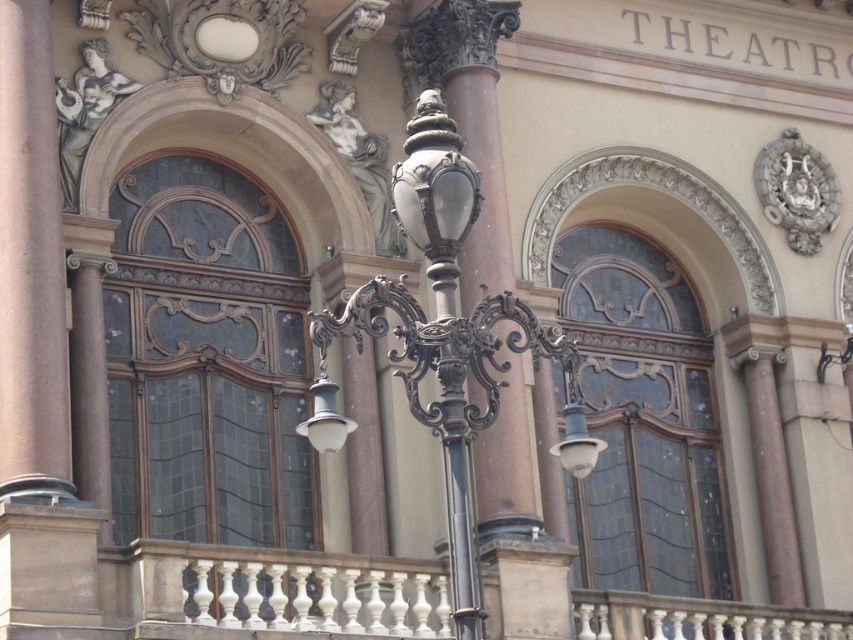
In the scene shown: Measure the distance between polished bronze streetlight at center and smooth pink stone column at left.

A distance of 33.79 feet exists between polished bronze streetlight at center and smooth pink stone column at left.

Image resolution: width=853 pixels, height=640 pixels. Find the location of `polished bronze streetlight at center`. polished bronze streetlight at center is located at coordinates (445, 339).

Image resolution: width=853 pixels, height=640 pixels. I want to click on polished bronze streetlight at center, so click(x=445, y=339).